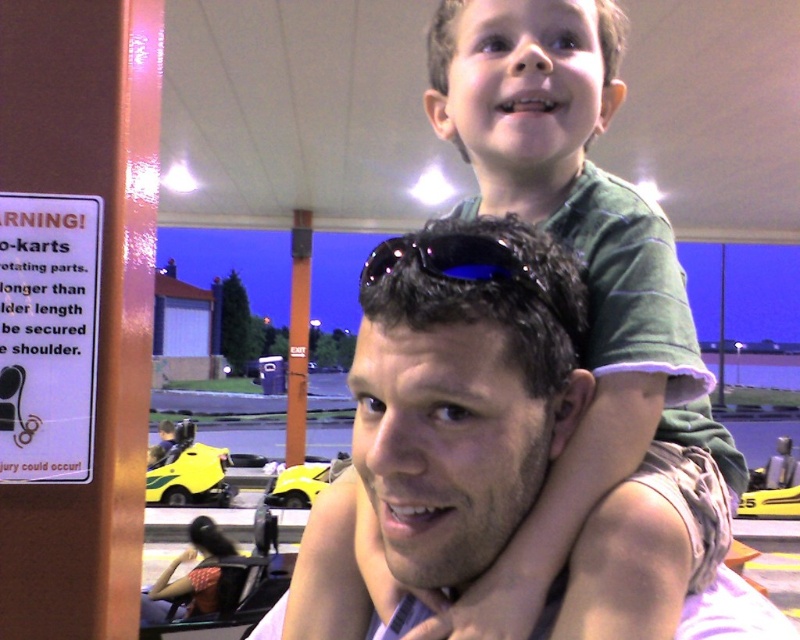
Does black reflective sunglasses at center have a lesser height compared to yellow plastic go-kart at center?

Yes.

Does black reflective sunglasses at center appear under yellow plastic go-kart at center?

Actually, black reflective sunglasses at center is above yellow plastic go-kart at center.

Measure the distance between black reflective sunglasses at center and camera.

The distance of black reflective sunglasses at center from camera is 21.21 inches.

This screenshot has height=640, width=800. I want to click on black reflective sunglasses at center, so click(x=454, y=260).

Which is more to the right, black reflective sunglasses at center or yellow plastic go-kart at lower left?

From the viewer's perspective, black reflective sunglasses at center appears more on the right side.

Can you confirm if black reflective sunglasses at center is positioned to the left of yellow plastic go-kart at lower left?

No, black reflective sunglasses at center is not to the left of yellow plastic go-kart at lower left.

Describe the element at coordinates (454, 260) in the screenshot. I see `black reflective sunglasses at center` at that location.

Find the location of `black reflective sunglasses at center`. black reflective sunglasses at center is located at coordinates (454, 260).

Between brown hair at upper center and yellow plastic go-kart at lower left, which one appears on the right side from the viewer's perspective?

From the viewer's perspective, brown hair at upper center appears more on the right side.

Does point (421, 531) lie behind point (189, 451)?

No, (421, 531) is in front of (189, 451).

The height and width of the screenshot is (640, 800). Identify the location of brown hair at upper center. (462, 388).